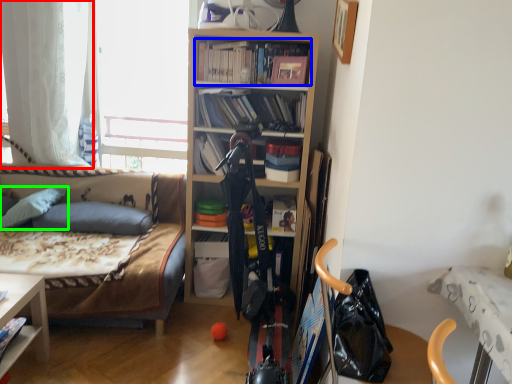
Question: Estimate the real-world distances between objects in this image. Which object is farther from curtain (highlighted by a red box), book (highlighted by a blue box) or pillow (highlighted by a green box)?

Choices:
 (A) book
 (B) pillow

Answer: (A)